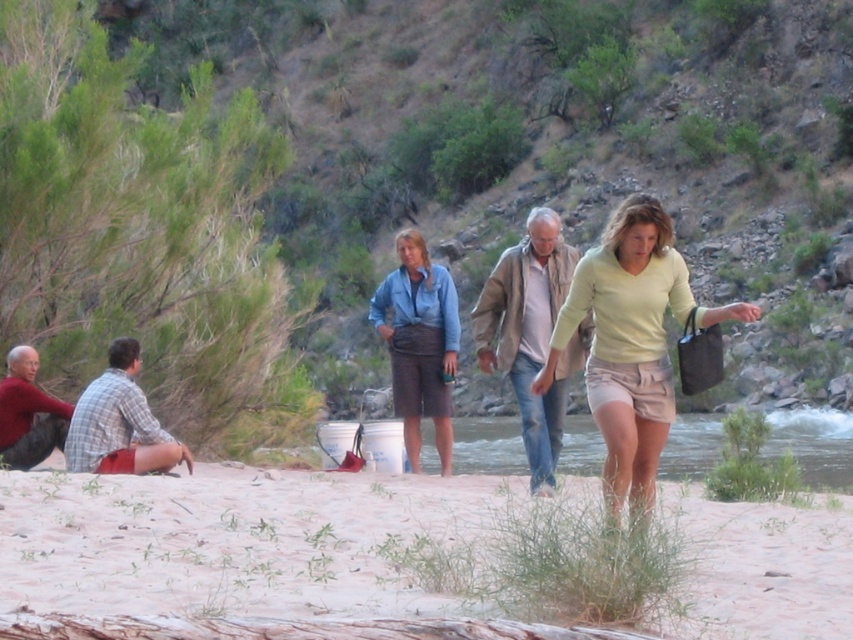
Question: Does light beige sand at lower center have a larger size compared to matte red shirt at lower left?

Choices:
 (A) no
 (B) yes

Answer: (B)

Question: Among these points, which one is nearest to the camera?

Choices:
 (A) (410, 416)
 (B) (636, 273)
 (C) (294, 512)

Answer: (B)

Question: Which object is positioned farthest from the matte red shirt at lower left?

Choices:
 (A) light brown leather jacket at center
 (B) matte blue shirt at center
 (C) light beige sand at lower center

Answer: (A)

Question: Which of the following is the closest to the observer?

Choices:
 (A) light brown leather jacket at center
 (B) matte red shirt at lower left
 (C) plaid fabric shirt at left

Answer: (A)

Question: Can you confirm if light yellow fabric skirt at center is positioned above plaid fabric shirt at left?

Choices:
 (A) no
 (B) yes

Answer: (B)

Question: Can you confirm if matte blue shirt at center is positioned below plaid fabric shirt at left?

Choices:
 (A) yes
 (B) no

Answer: (A)